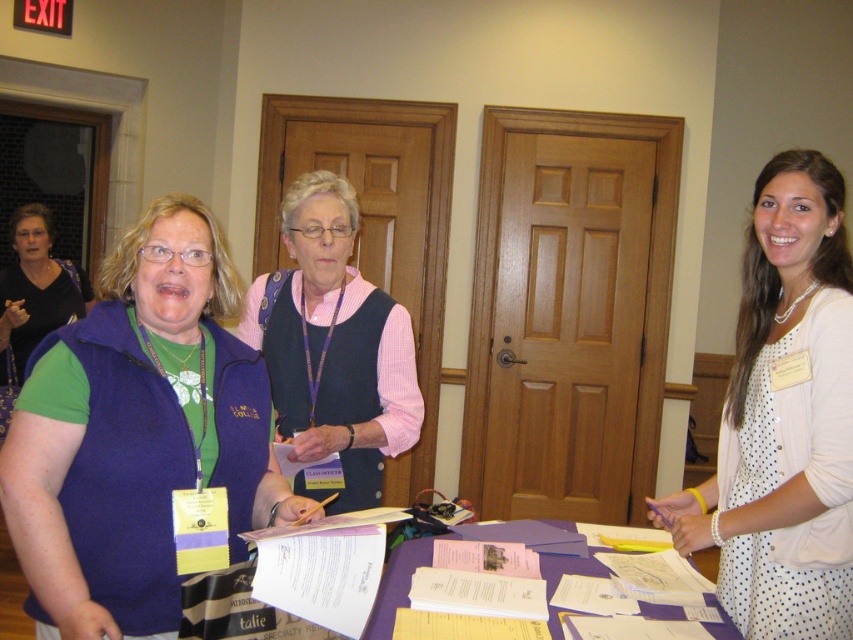
You are organizing a conference and need to place a name tag on the table. The name tag is the same height as the purple paper at center. Can the name tag fit vertically under the matte black sweater at left without overlapping?

The matte black sweater at left has a greater height compared to the purple paper at center. Since the name tag is the same height as the purple paper at center, it can fit vertically under the matte black sweater at left as there is enough vertical space.

You are navigating through the conference room and need to reach a specific location. There are two points marked in the scene, one at coordinates point (257, 522) and another at point (315, 376). Which point is closer to you as you face the table?

Point (257, 522) is in front of point (315, 376), so it is closer to you as you face the table.

You are organizing a conference and need to place a 3 feet wide banner between the matte black sweater at left and the purple paper at center. Is there enough space?

The distance between the matte black sweater at left and the purple paper at center is 8.82 feet, so yes, there is enough space to place a 3 feet wide banner between them.